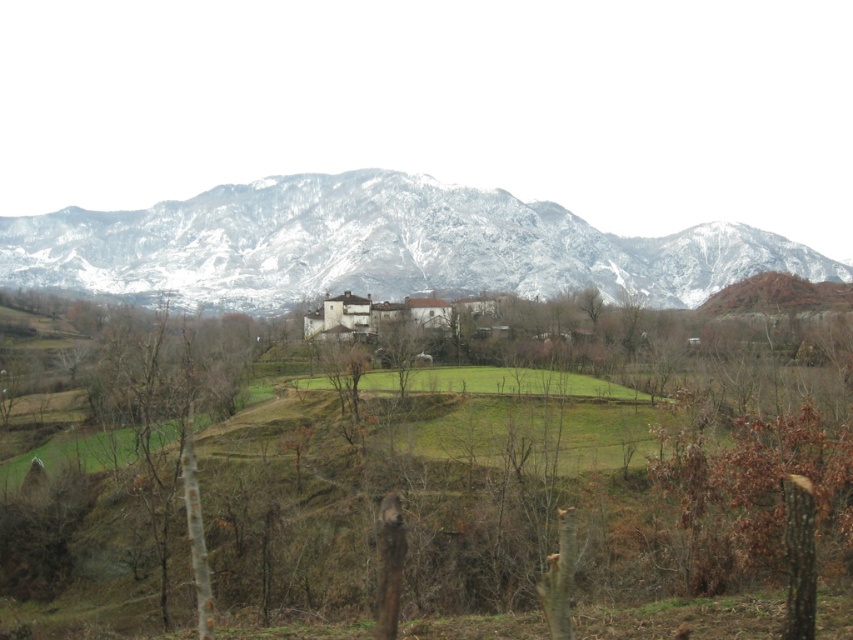
You are standing at the origin point of the image and want to locate the brown rough tree at center. In which direction should you look to find it?

You should look towards the coordinates point at (412, 461) to find the brown rough tree at center.

You are an artist standing in the middle of a field, looking at the brown rough tree at center and the snowy rock mountain range at upper center. Which object is closer to your left side?

The brown rough tree at center is positioned on the right side of snowy rock mountain range at upper center, so the snowy rock mountain range at upper center is closer to your left side.

You are an artist looking to capture the landscape in a painting. You want to ensure the brown rough tree at center and the snowy rock mountain range at upper center are proportionally accurate. Which object should you paint smaller to maintain the correct scale?

The brown rough tree at center should be painted smaller than the snowy rock mountain range at upper center because the brown rough tree at center has a smaller size compared to snowy rock mountain range at upper center.